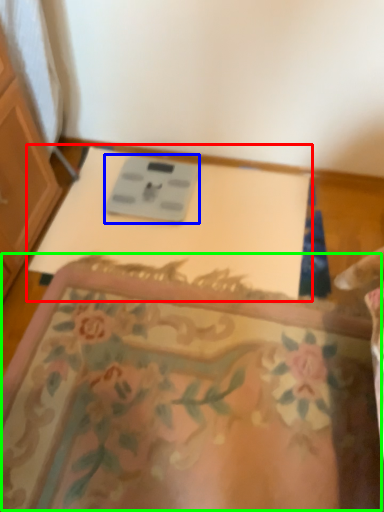
Question: Considering the real-world distances, which object is closest to changing table (highlighted by a red box)? scale (highlighted by a blue box) or mat (highlighted by a green box).

Choices:
 (A) scale
 (B) mat

Answer: (A)